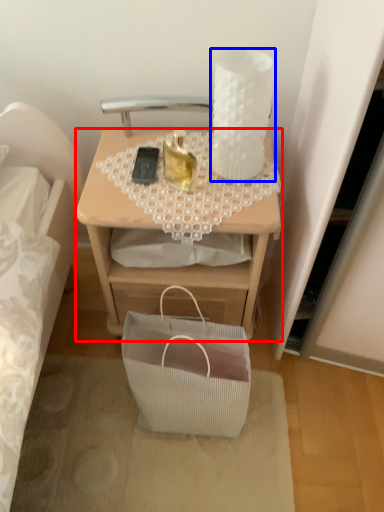
Question: Which of the following is the closest to the observer, desk (highlighted by a red box) or candle holder (highlighted by a blue box)?

Choices:
 (A) desk
 (B) candle holder

Answer: (B)